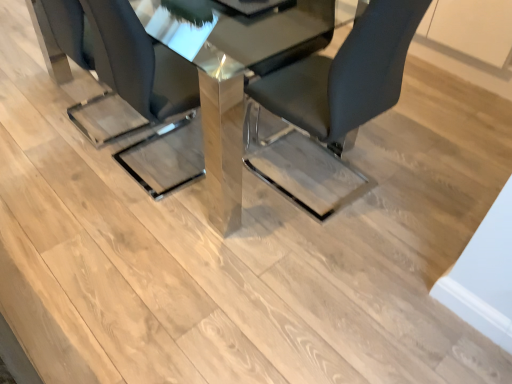
Find the location of a particular element. space that is in front of polished glass table at center is located at coordinates (160, 263).